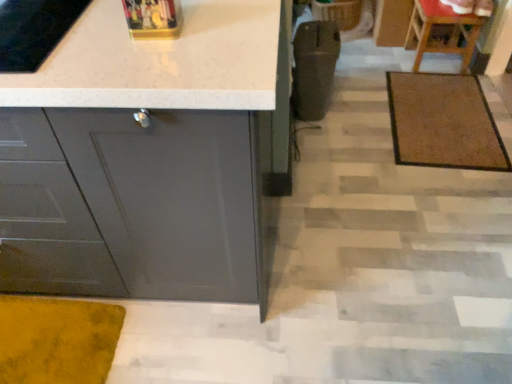
This screenshot has height=384, width=512. Find the location of `vacant space positioned to the left of brown textured mat at center right`. vacant space positioned to the left of brown textured mat at center right is located at coordinates [x=355, y=128].